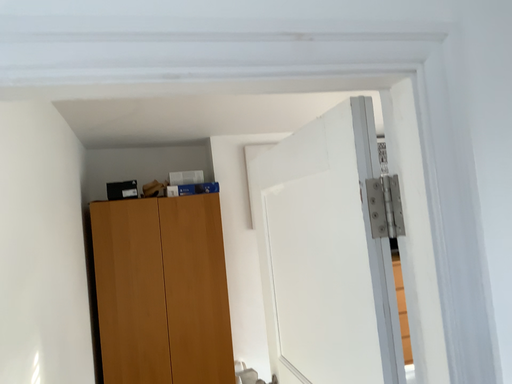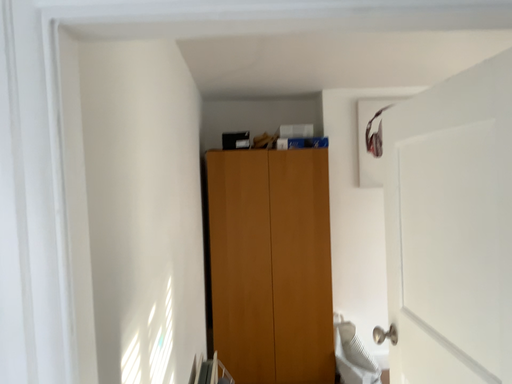
Question: How did the camera likely rotate when shooting the video?

Choices:
 (A) rotated right
 (B) rotated left

Answer: (B)